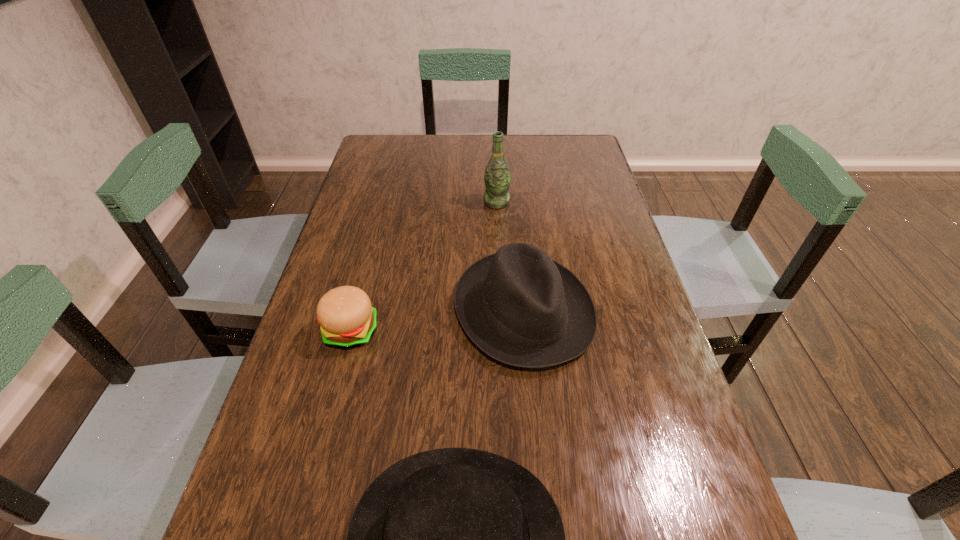
The image size is (960, 540). What are the coordinates of `the farthest object` in the screenshot? It's located at (497, 177).

This screenshot has width=960, height=540. I want to click on beer bottle, so (x=497, y=177).

Find the location of a particular element. Image resolution: width=960 pixels, height=540 pixels. the farther fedora is located at coordinates [520, 307].

Where is `the third shortest object`? Image resolution: width=960 pixels, height=540 pixels. the third shortest object is located at coordinates (520, 307).

Find the location of a particular element. This screenshot has width=960, height=540. hamburger is located at coordinates (347, 319).

This screenshot has width=960, height=540. What are the coordinates of `vacant space located on the surface of the tallest object` in the screenshot? It's located at (497, 225).

Identify the location of vacant area situated on the right of the taller fedora. This screenshot has width=960, height=540. pyautogui.click(x=617, y=310).

This screenshot has height=540, width=960. Find the location of `vacant point located on the front of the hamburger`. vacant point located on the front of the hamburger is located at coordinates (308, 497).

The height and width of the screenshot is (540, 960). Identify the location of object that is at the left edge. (347, 319).

This screenshot has height=540, width=960. I want to click on object at the right edge, so click(x=520, y=307).